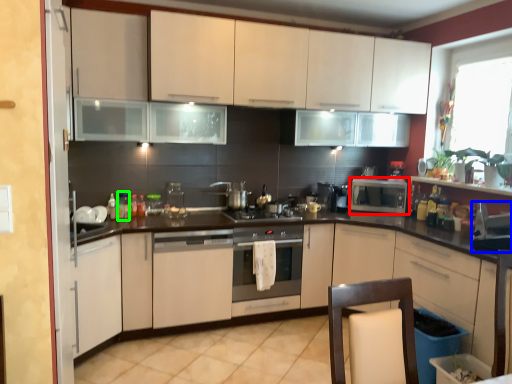
Question: Considering the real-world distances, which object is closest to microwave oven (highlighted by a red box)? appliance (highlighted by a blue box) or bottle (highlighted by a green box).

Choices:
 (A) appliance
 (B) bottle

Answer: (A)